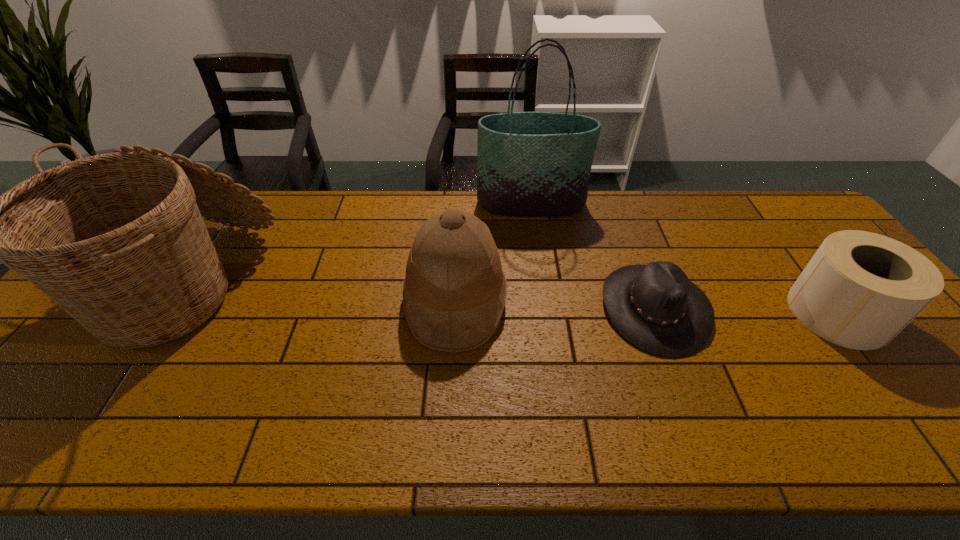
Where is `the tallest object`? the tallest object is located at coordinates (533, 164).

At what (x,y) coordinates should I click in order to perform the action: click on tote bag. Please return your answer as a coordinate pair (x, y). Looking at the image, I should click on (533, 164).

In order to click on the leftmost object in this screenshot , I will do `click(117, 240)`.

You are a GUI agent. You are given a task and a screenshot of the screen. Output one action in this format:
    pyautogui.click(x=<x>, y=<y>)
    Task: Click on the basket
    This screenshot has height=540, width=960.
    Given the screenshot: What is the action you would take?
    pyautogui.click(x=117, y=240)

At what (x,y) coordinates should I click in order to perform the action: click on the left hat. Please return your answer as a coordinate pair (x, y). Looking at the image, I should click on (454, 292).

This screenshot has height=540, width=960. I want to click on the third tallest object, so click(454, 292).

Where is `toilet tissue`? The width and height of the screenshot is (960, 540). toilet tissue is located at coordinates (860, 289).

Locate an element on the screen. the fourth tallest object is located at coordinates (860, 289).

Image resolution: width=960 pixels, height=540 pixels. I want to click on the shorter hat, so click(655, 307).

Locate an element on the screen. This screenshot has height=540, width=960. the shortest object is located at coordinates (655, 307).